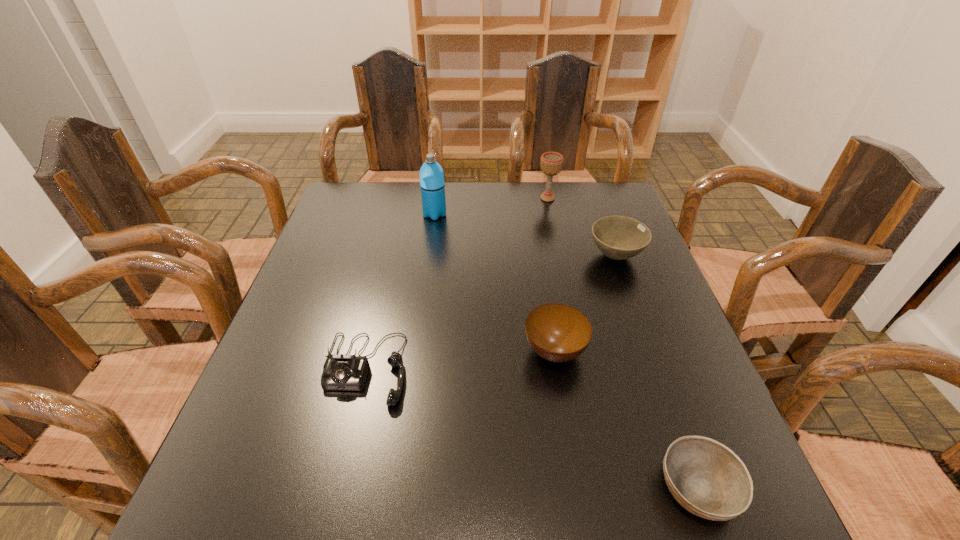
Where is `free region at the far edge`? This screenshot has width=960, height=540. free region at the far edge is located at coordinates (493, 219).

The width and height of the screenshot is (960, 540). Find the location of `vacant space at the near edge of the desktop`. vacant space at the near edge of the desktop is located at coordinates (367, 526).

Where is `blank space at the left edge`? This screenshot has width=960, height=540. blank space at the left edge is located at coordinates (346, 256).

This screenshot has width=960, height=540. What are the coordinates of `free space at the right edge` in the screenshot? It's located at (624, 273).

Locate an element on the screen. free location at the far left corner is located at coordinates (368, 210).

What are the coordinates of `vacant space at the far right corner of the desktop` in the screenshot? It's located at (589, 207).

This screenshot has height=540, width=960. In order to click on vacant area that lies between the shortest object and the chalice in this screenshot , I will do `click(623, 343)`.

Locate an element on the screen. vacant area that lies between the farthest object and the fourth nearest object is located at coordinates (582, 227).

You are a GUI agent. You are given a task and a screenshot of the screen. Output one action in this format:
    pyautogui.click(x=<x>, y=<y>)
    Task: Click on the vacant area that lies between the telephone and the leftmost bowl
    This screenshot has height=540, width=960.
    Given the screenshot: What is the action you would take?
    pyautogui.click(x=460, y=360)

Find the location of a particular element. This screenshot has height=540, width=960. unoccupied position between the fourth nearest object and the chalice is located at coordinates (582, 227).